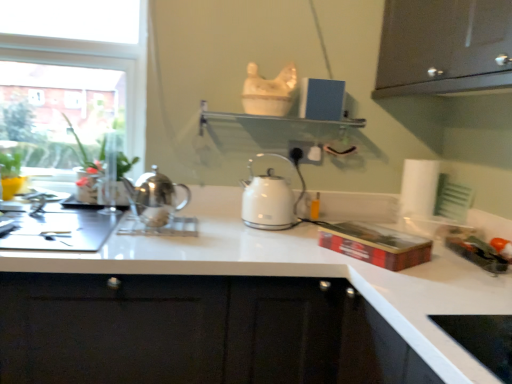
Question: From a real-world perspective, is white paper towel at right positioned under polished silver kettle at center, which ranks as the 1th kettle in left-to-right order, based on gravity?

Choices:
 (A) yes
 (B) no

Answer: (B)

Question: Considering the relative sizes of white paper towel at right and polished silver kettle at center, the 2th kettle positioned from the right, in the image provided, is white paper towel at right bigger than polished silver kettle at center, the 2th kettle positioned from the right,?

Choices:
 (A) yes
 (B) no

Answer: (A)

Question: Is white paper towel at right facing towards polished silver kettle at center, the 1th kettle viewed from the front?

Choices:
 (A) yes
 (B) no

Answer: (B)

Question: From the image's perspective, is white paper towel at right above polished silver kettle at center, placed as the 2th kettle when sorted from back to front?

Choices:
 (A) no
 (B) yes

Answer: (A)

Question: From a real-world perspective, does white paper towel at right stand above polished silver kettle at center, the 2th kettle positioned from the right?

Choices:
 (A) no
 (B) yes

Answer: (B)

Question: Considering the relative sizes of white paper towel at right and polished silver kettle at center, placed as the 2th kettle when sorted from back to front, in the image provided, is white paper towel at right shorter than polished silver kettle at center, placed as the 2th kettle when sorted from back to front,?

Choices:
 (A) yes
 (B) no

Answer: (B)

Question: Considering the relative sizes of white plastic electric outlet at center and white glossy kettle at center, which is the second kettle from left to right, in the image provided, is white plastic electric outlet at center smaller than white glossy kettle at center, which is the second kettle from left to right,?

Choices:
 (A) no
 (B) yes

Answer: (B)

Question: Does white plastic electric outlet at center touch white glossy kettle at center, placed as the 1th kettle when sorted from back to front?

Choices:
 (A) no
 (B) yes

Answer: (A)

Question: Could you tell me if white plastic electric outlet at center is facing white glossy kettle at center, placed as the 1th kettle when sorted from back to front?

Choices:
 (A) yes
 (B) no

Answer: (B)

Question: Does white plastic electric outlet at center have a greater height compared to white glossy kettle at center, the 2th kettle positioned from the front?

Choices:
 (A) yes
 (B) no

Answer: (B)

Question: Is white plastic electric outlet at center completely or partially outside of white glossy kettle at center, placed as the 1th kettle when sorted from back to front?

Choices:
 (A) no
 (B) yes

Answer: (B)

Question: From the image's perspective, is white plastic electric outlet at center located beneath white glossy kettle at center, which is the second kettle from left to right?

Choices:
 (A) yes
 (B) no

Answer: (B)

Question: Does white glossy shelf at upper center lie behind green glossy plant at left?

Choices:
 (A) no
 (B) yes

Answer: (A)